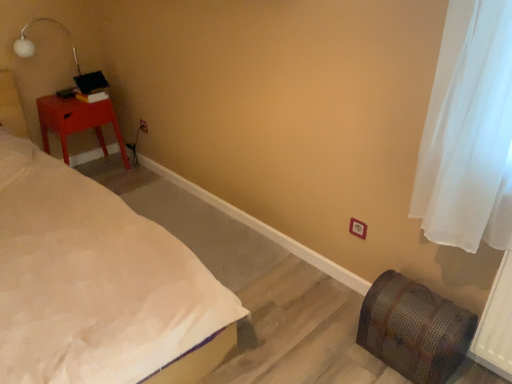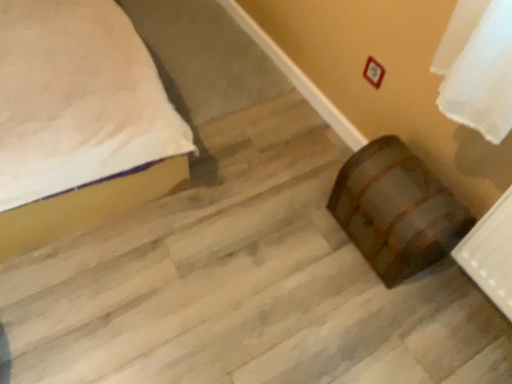
Question: Which way did the camera rotate in the video?

Choices:
 (A) rotated downward
 (B) rotated upward

Answer: (A)